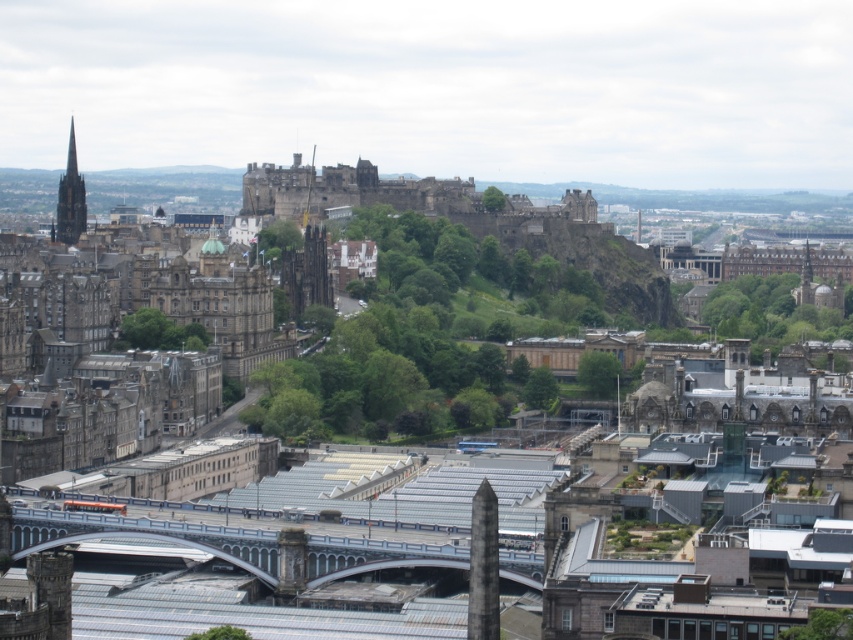
Is the position of metallic gray bridge at center less distant than that of dark gray stone spire at center?

Yes, metallic gray bridge at center is in front of dark gray stone spire at center.

Can you confirm if metallic gray bridge at center is positioned above dark gray stone spire at center?

Incorrect, metallic gray bridge at center is not positioned above dark gray stone spire at center.

Is point (120, 616) positioned behind point (312, 164)?

No, (120, 616) is in front of (312, 164).

Identify the location of metallic gray bridge at center. (231, 541).

Which is more to the left, matte stone spire at left or dark gray stone spire at center?

Positioned to the left is matte stone spire at left.

Between point (61, 234) and point (306, 221), which one is positioned in front?

Positioned in front is point (61, 234).

Find the location of `matte stone spire at left`. matte stone spire at left is located at coordinates (70, 198).

Does metallic gray bridge at center have a larger size compared to matte stone spire at left?

Yes.

Who is more forward, (325, 636) or (74, 209)?

Point (325, 636) is in front.

I want to click on metallic gray bridge at center, so click(x=231, y=541).